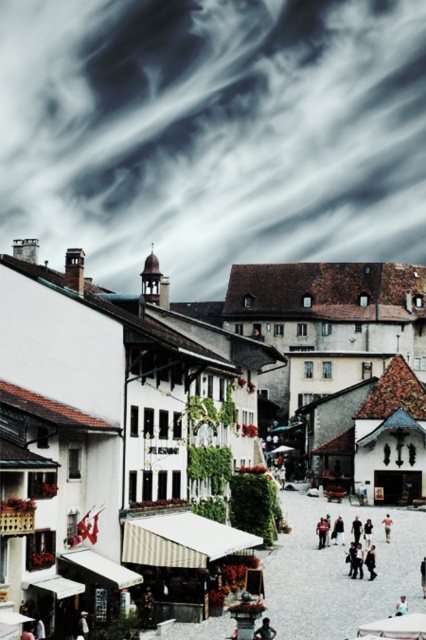
Who is positioned more to the left, light brown leather jacket at center or light blue fabric shirt at center?

light brown leather jacket at center

Does light brown leather jacket at center have a smaller size compared to light blue fabric shirt at center?

Indeed, light brown leather jacket at center has a smaller size compared to light blue fabric shirt at center.

Measure the distance between point (x=261, y=628) and camera.

They are 180.48 feet apart.

This screenshot has width=426, height=640. I want to click on light brown leather jacket at center, so click(264, 630).

Is dark gray cloud at upper center taller than light blue fabric shirt at center?

Correct, dark gray cloud at upper center is much taller as light blue fabric shirt at center.

Does point (333, 202) lie behind point (399, 612)?

Yes, point (333, 202) is behind point (399, 612).

Is point (288, 198) in front of point (397, 614)?

No, (288, 198) is further to viewer.

This screenshot has width=426, height=640. Identify the location of dark gray cloud at upper center. (213, 132).

Where is `white cotton shirt at center`? white cotton shirt at center is located at coordinates (83, 625).

Between point (78, 628) and point (400, 609), which one is positioned behind?

Point (400, 609)

Who is more forward, (86, 618) or (403, 598)?

Positioned in front is point (86, 618).

What are the coordinates of `white cotton shirt at center` in the screenshot? It's located at (83, 625).